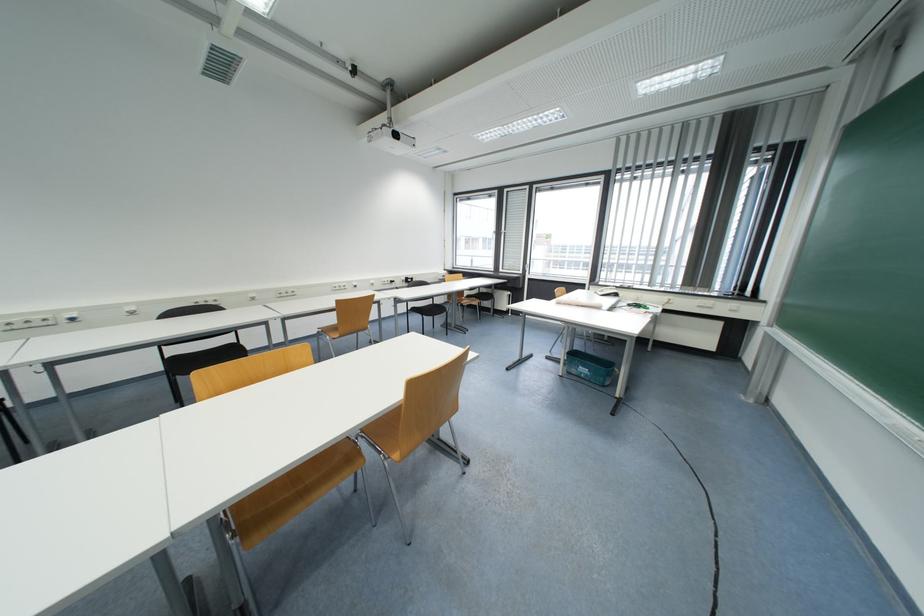
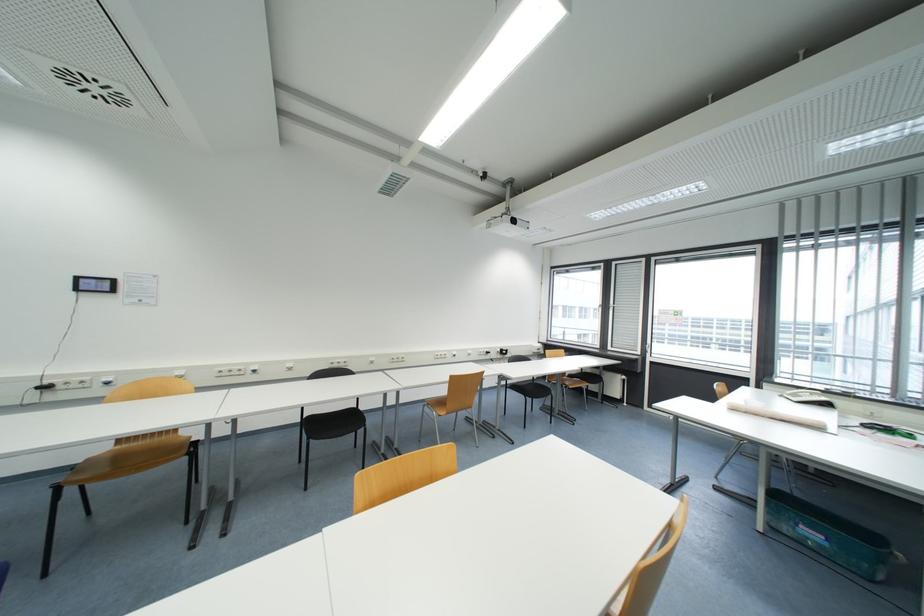
Question: In a continuous first-person perspective shot, in which direction is the camera moving?

Choices:
 (A) Left
 (B) Right
 (C) Forward
 (D) Backward

Answer: (A)